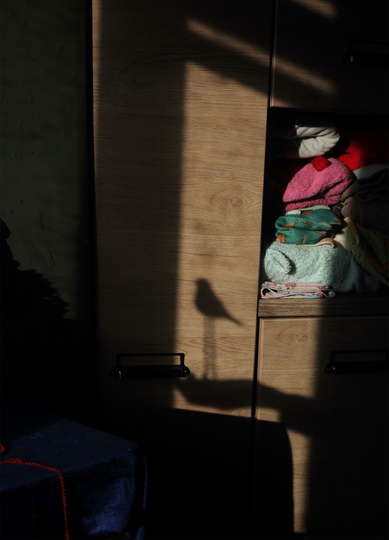
Locate an element on the screen. This screenshot has width=389, height=540. cubbyhole in dresser is located at coordinates (276, 170).